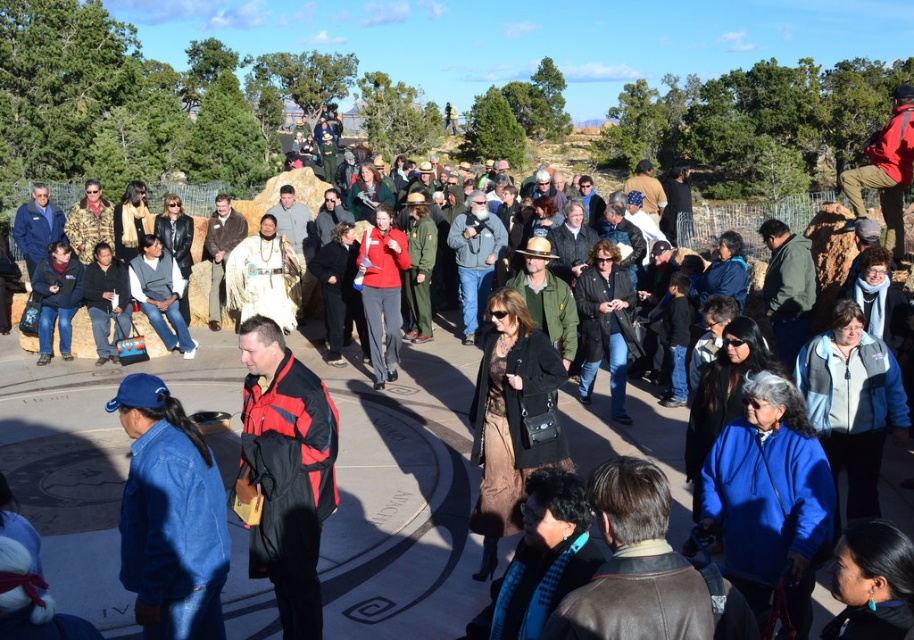
Is point (157, 557) behind point (328, 515)?

No, it is in front of (328, 515).

Describe the element at coordinates (169, 516) in the screenshot. I see `denim jacket at lower left` at that location.

Does point (218, 476) come behind point (294, 605)?

No, it is not.

Locate an element on the screen. The width and height of the screenshot is (914, 640). denim jacket at lower left is located at coordinates (169, 516).

Who is lower down, denim jacket at lower left or matte red jacket at center?

Positioned lower is denim jacket at lower left.

Can you confirm if denim jacket at lower left is positioned below matte red jacket at center?

Correct, denim jacket at lower left is located below matte red jacket at center.

Is point (121, 545) positioned before point (381, 387)?

Yes, it is in front of point (381, 387).

Identify the location of denim jacket at lower left. The height and width of the screenshot is (640, 914). (169, 516).

Can you confirm if red/black jacket at center is positioned below matte red jacket at center?

Yes, red/black jacket at center is below matte red jacket at center.

Which is more to the right, red/black jacket at center or matte red jacket at center?

matte red jacket at center

Identify the location of red/black jacket at center. The height and width of the screenshot is (640, 914). (287, 472).